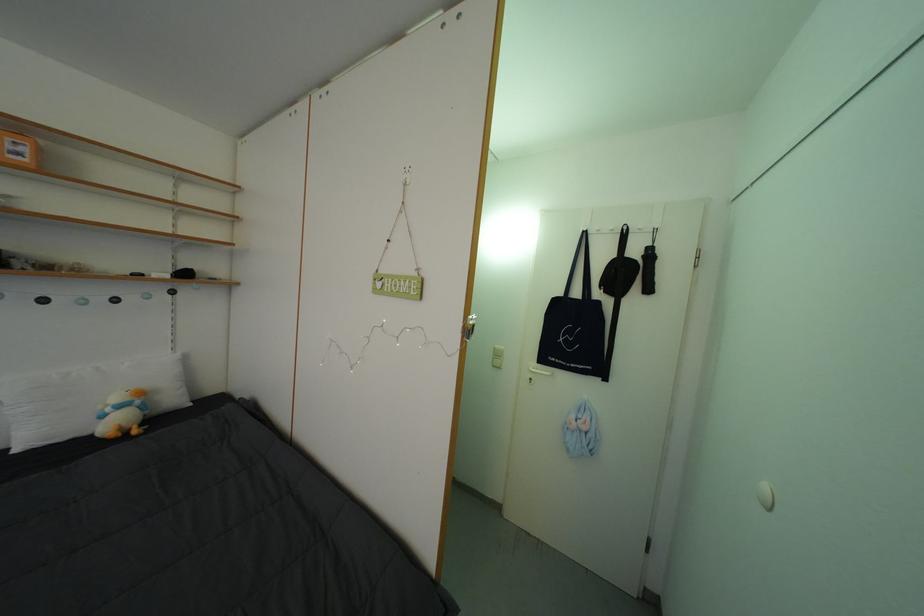
Which object does [18,150] point to?

It corresponds to the orange box in the image.